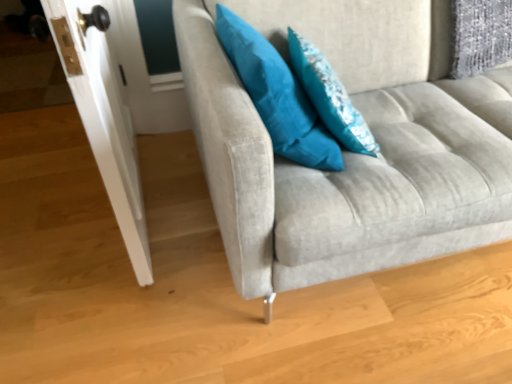
Question: From their relative heights in the image, would you say teal fabric pillow at upper center, positioned as the first pillow in right-to-left order, is taller or shorter than white glossy door at left?

Choices:
 (A) short
 (B) tall

Answer: (A)

Question: From the image's perspective, is teal fabric pillow at upper center, positioned as the first pillow in right-to-left order, positioned above or below white glossy door at left?

Choices:
 (A) above
 (B) below

Answer: (B)

Question: Which object is the closest to the teal fabric pillow at upper right, arranged as the second pillow when viewed from the right?

Choices:
 (A) suede gray couch at center
 (B) white glossy door at left
 (C) teal fabric pillow at upper center, positioned as the first pillow in right-to-left order

Answer: (C)

Question: Which object is positioned closest to the teal fabric pillow at upper center, positioned as the first pillow in right-to-left order?

Choices:
 (A) suede gray couch at center
 (B) teal fabric pillow at upper right, the 1th pillow positioned from the left
 (C) white glossy door at left

Answer: (B)